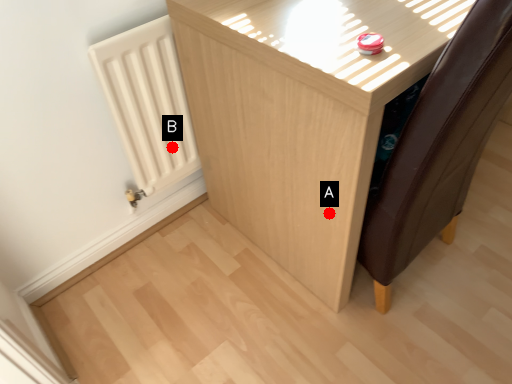
Question: Two points are circled on the image, labeled by A and B beside each circle. Which point is further to the camera?

Choices:
 (A) A is further
 (B) B is further

Answer: (B)